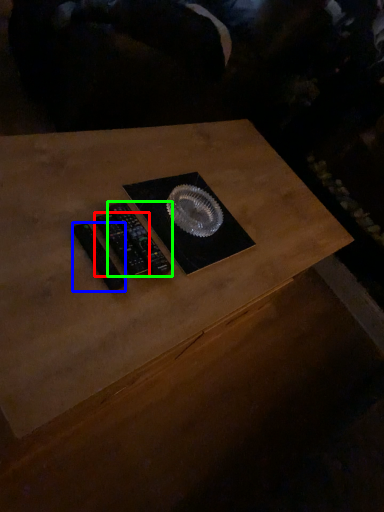
Question: Estimate the real-world distances between objects in this image. Which object is closer to control (highlighted by a red box), control (highlighted by a blue box) or control (highlighted by a green box)?

Choices:
 (A) control
 (B) control

Answer: (B)